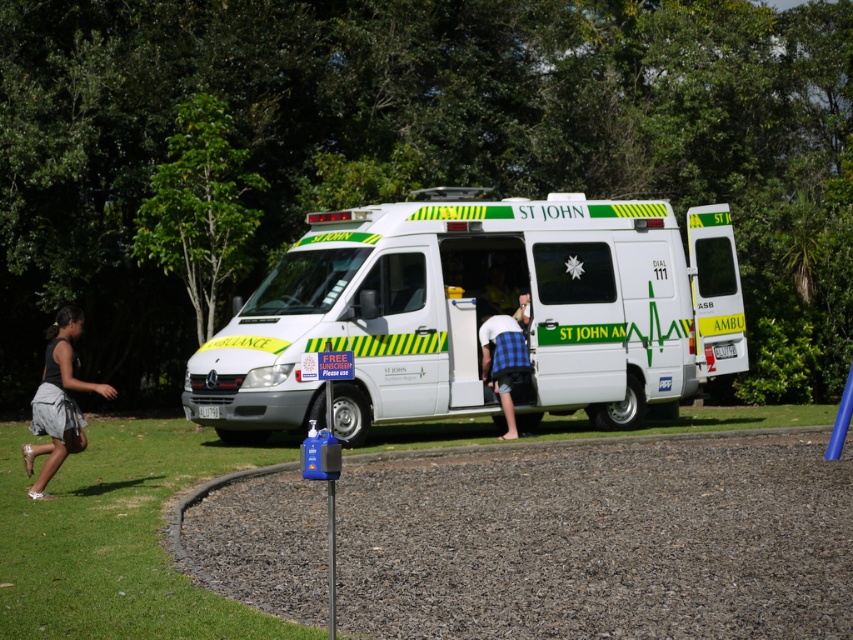
You are a photographer trying to capture both the gray cotton skirt at lower left and the blue plaid shirt at center in the same frame. Based on their heights, which one should you focus on first to ensure both are visible in the photo?

The gray cotton skirt at lower left has a lesser height compared to the blue plaid shirt at center. To ensure both are visible, focus on the taller blue plaid shirt at center first, then adjust the camera angle to include the shorter gray cotton skirt at lower left.